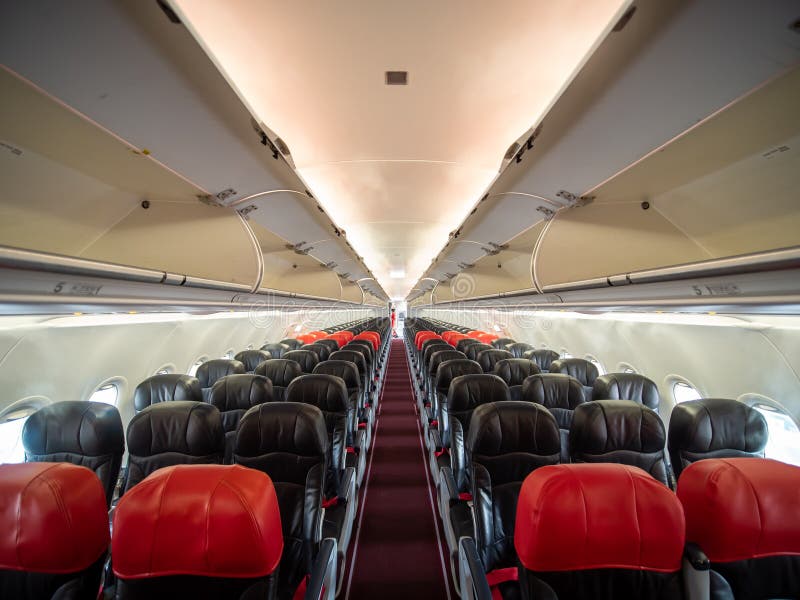
Identify the location of red top covered seats. (80, 518), (166, 529), (572, 513), (713, 507).